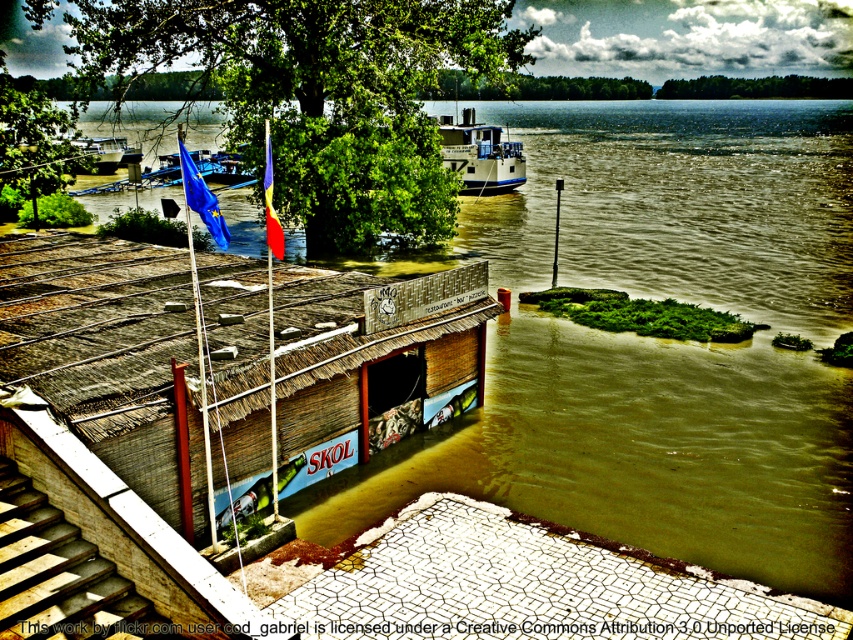
Question: Can you confirm if brown thatched hut at center is thinner than wooden stairs at lower left?

Choices:
 (A) yes
 (B) no

Answer: (B)

Question: Which object appears farthest from the camera in this image?

Choices:
 (A) wooden stairs at lower left
 (B) white glossy boat at center

Answer: (B)

Question: Which of the following is the farthest from the observer?

Choices:
 (A) (80, 140)
 (B) (357, 305)
 (C) (108, 570)

Answer: (A)

Question: Is brown thatched hut at center bigger than wooden stairs at lower left?

Choices:
 (A) no
 (B) yes

Answer: (B)

Question: Is the position of brown thatched hut at center more distant than that of wooden stairs at lower left?

Choices:
 (A) no
 (B) yes

Answer: (B)

Question: Which point is closer to the camera taking this photo?

Choices:
 (A) (459, 163)
 (B) (93, 632)

Answer: (B)